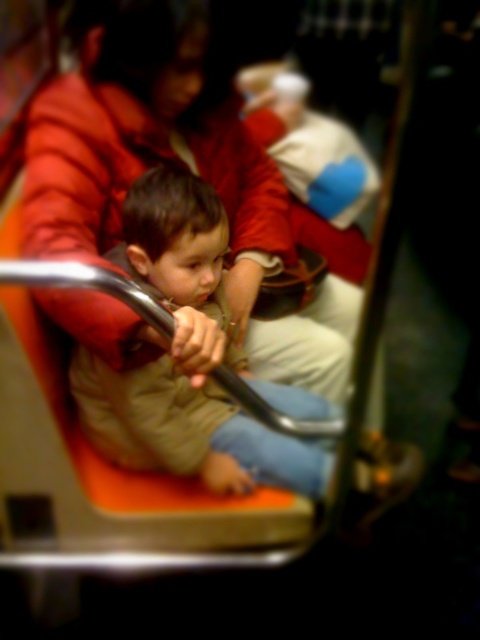
You are a passenger on a moving bus and see two people in the scene. The first is wearing a matte red jacket at upper left, and the second is wearing a khaki fabric jacket at center. Which person is standing closer to the front of the bus?

The matte red jacket at upper left is much taller than the khaki fabric jacket at center, so the person wearing the matte red jacket at upper left is closer to the front of the bus.

You are a passenger on a moving train and you see the matte red jacket at upper left and the khaki fabric jacket at center. Which jacket is closer to you?

The matte red jacket at upper left is closer to you than the khaki fabric jacket at center.

In the scene shown: You are a passenger on a moving train and need to reach the matte red jacket at upper left to retrieve your scarf. The train is moving at 60 km per hour. Can you safely reach it while standing?

The matte red jacket at upper left is 34.68 inches away from the camera. Since the train is moving at 60 km per hour, reaching out might be unsafe due to potential sudden movements or lack of stability. It is advisable to wait until the train stops to avoid injury.